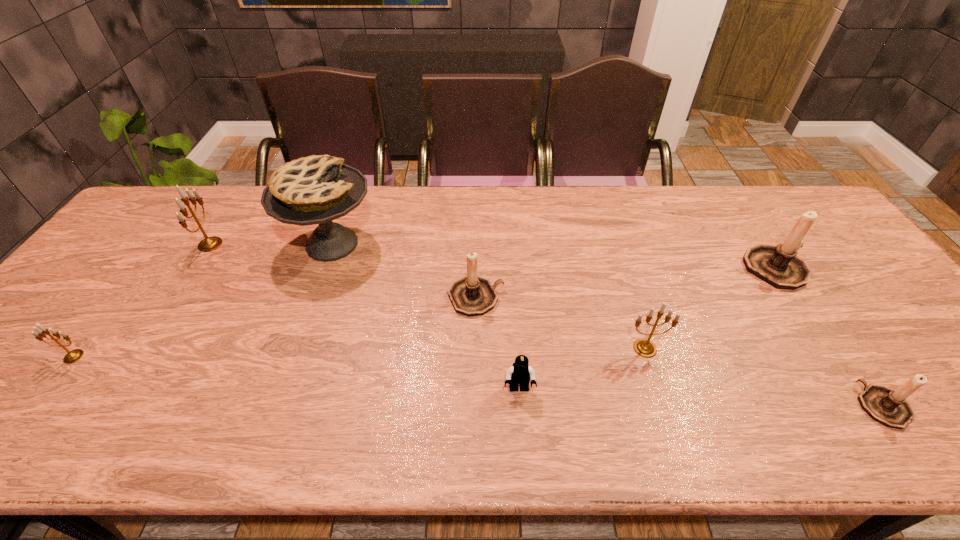
The width and height of the screenshot is (960, 540). In order to click on free spot between the black Lego and the farthest gold candelabrum in this screenshot , I will do `click(365, 317)`.

You are a GUI agent. You are given a task and a screenshot of the screen. Output one action in this format:
    pyautogui.click(x=<x>, y=<y>)
    Task: Click on the closest object to the second smallest brown candle holder
    
    Given the screenshot: What is the action you would take?
    pyautogui.click(x=520, y=373)

In order to click on the sixth closest object to the fifth candelabrum from right to left in this screenshot , I will do coord(777,265).

Point out which candelabrum is positioned as the nearest to the nearest candelabrum. Please provide its 2D coordinates. Your answer should be formatted as a tuple, i.e. [(x, y)], where the tuple contains the x and y coordinates of a point satisfying the conditions above.

[(777, 265)]

Locate an element on the screen. Image resolution: width=960 pixels, height=540 pixels. the second closest candelabrum relative to the third candelabrum from left to right is located at coordinates (777, 265).

Locate an element on the screen. This screenshot has height=540, width=960. the closest brown candle holder relative to the biggest brown candle holder is located at coordinates (888, 407).

Locate an element on the screen. brown candle holder that is the closest to the pie is located at coordinates [x=472, y=295].

This screenshot has height=540, width=960. What are the coordinates of `gold candelabrum object that ranks as the closest to the pie` in the screenshot? It's located at pos(208,244).

This screenshot has width=960, height=540. I want to click on gold candelabrum that can be found as the closest to the Lego, so click(x=643, y=347).

Where is `free spot that satisfies the following two spatial constraints: 1. on the front side of the farthest gold candelabrum; 2. on the right side of the sixth object from left to right`? The width and height of the screenshot is (960, 540). free spot that satisfies the following two spatial constraints: 1. on the front side of the farthest gold candelabrum; 2. on the right side of the sixth object from left to right is located at coordinates (144, 348).